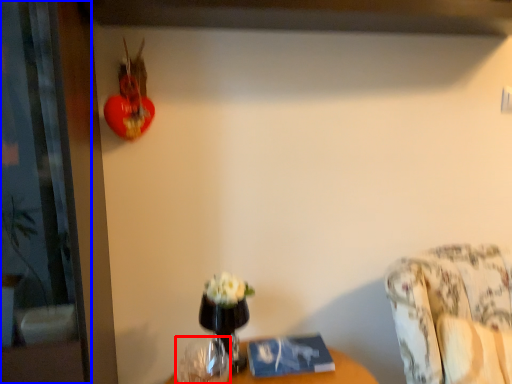
Question: Which point is further to the camera, vase (highlighted by a red box) or screen door (highlighted by a blue box)?

Choices:
 (A) vase
 (B) screen door

Answer: (A)